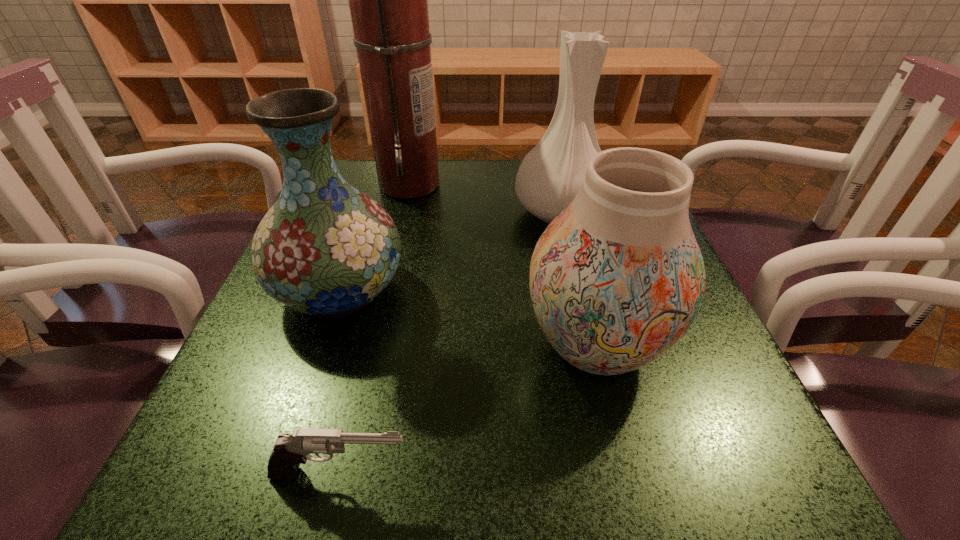
This screenshot has width=960, height=540. Find the location of `vacant space at the right edge`. vacant space at the right edge is located at coordinates (629, 386).

In order to click on vacant space at the far left corner of the desktop in this screenshot , I will do `click(391, 198)`.

You are a GUI agent. You are given a task and a screenshot of the screen. Output one action in this format:
    pyautogui.click(x=<x>, y=<y>)
    Task: Click on the free spot at the near right corner of the desktop
    The height and width of the screenshot is (540, 960).
    Given the screenshot: What is the action you would take?
    pyautogui.click(x=769, y=512)

This screenshot has width=960, height=540. I want to click on vacant area that lies between the farthest vase and the nearest object, so click(450, 343).

Where is `free point between the leftmost vase and the nearest object`? This screenshot has height=540, width=960. free point between the leftmost vase and the nearest object is located at coordinates (341, 382).

What are the coordinates of `vacant point located between the shortest object and the farthest vase` in the screenshot? It's located at (450, 343).

Image resolution: width=960 pixels, height=540 pixels. What are the coordinates of `vacant space in between the tallest object and the shortest object` in the screenshot? It's located at (375, 329).

Find the location of a particular element. vacant space in between the nearest object and the farthest vase is located at coordinates click(450, 343).

Identify the location of the second closest object to the leftmost vase. Image resolution: width=960 pixels, height=540 pixels. (616, 279).

Image resolution: width=960 pixels, height=540 pixels. What are the coordinates of `object that is the second closest one to the shortest object` in the screenshot? It's located at (326, 249).